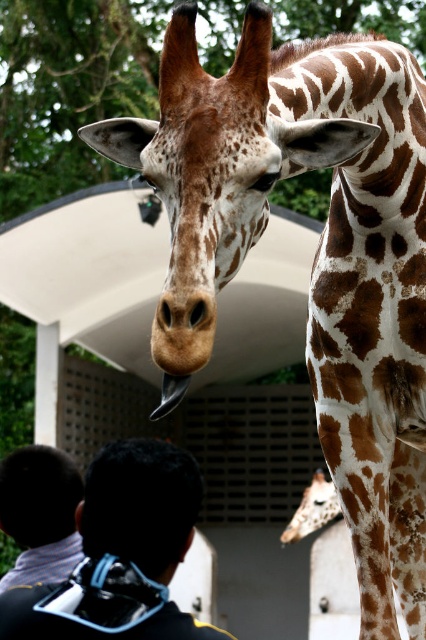
Is dark brown hair at lower left above spotted fur at center?

Yes, dark brown hair at lower left is above spotted fur at center.

Which is below, dark brown hair at lower left or spotted fur at center?

spotted fur at center is lower down.

Describe the element at coordinates (39, 496) in the screenshot. I see `dark brown hair at lower left` at that location.

You are a GUI agent. You are given a task and a screenshot of the screen. Output one action in this format:
    pyautogui.click(x=<x>, y=<y>)
    Task: Click on the dark brown hair at lower left
    This screenshot has width=426, height=640.
    Given the screenshot: What is the action you would take?
    pyautogui.click(x=39, y=496)

Which is below, black matte mask at upper center or black matte hair at center?

black matte mask at upper center

Is black matte mask at upper center further to camera compared to black matte hair at center?

No, it is not.

Who is more forward, (94, 620) or (164, 525)?

Point (94, 620) is more forward.

Identify the location of black matte mask at upper center. (x=120, y=554).

Is black matte hair at center smaller than dark brown hair at lower left?

Indeed, black matte hair at center has a smaller size compared to dark brown hair at lower left.

Is point (89, 508) positioned after point (29, 545)?

No, it is not.

Find the location of `black matte hair at center`. black matte hair at center is located at coordinates (141, 504).

Where is `black matte hair at center`? The image size is (426, 640). black matte hair at center is located at coordinates (141, 504).